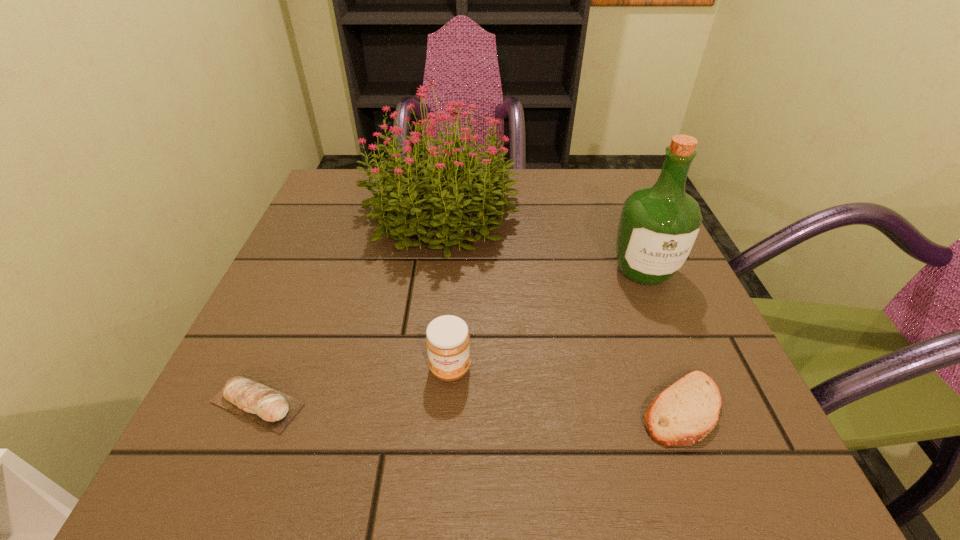
Locate an element on the screen. vacant space located on the right of the taller pita bread is located at coordinates (521, 403).

Identify the location of vacant area situated 0.240m on the left of the shortest object. The width and height of the screenshot is (960, 540). (476, 409).

The image size is (960, 540). In order to click on object that is at the far edge in this screenshot , I will do `click(465, 188)`.

You are a GUI agent. You are given a task and a screenshot of the screen. Output one action in this format:
    pyautogui.click(x=<x>, y=<y>)
    Task: Click on the bouquet located in the left edge section of the desktop
    Image resolution: width=960 pixels, height=540 pixels.
    Given the screenshot: What is the action you would take?
    pyautogui.click(x=465, y=188)

You are a GUI agent. You are given a task and a screenshot of the screen. Output one action in this format:
    pyautogui.click(x=<x>, y=<y>)
    Task: Click on the pita bread at the left edge
    The image size is (960, 540).
    Given the screenshot: What is the action you would take?
    pyautogui.click(x=270, y=408)

Image resolution: width=960 pixels, height=540 pixels. I want to click on liquor present at the right edge, so click(x=658, y=226).

This screenshot has width=960, height=540. Identify the location of pita bread that is at the right edge. (683, 414).

Locate an element on the screen. object that is at the far left corner is located at coordinates (465, 188).

Where is `object at the near left corner`? object at the near left corner is located at coordinates (270, 408).

The height and width of the screenshot is (540, 960). In order to click on object that is at the near right corner in this screenshot , I will do `click(683, 414)`.